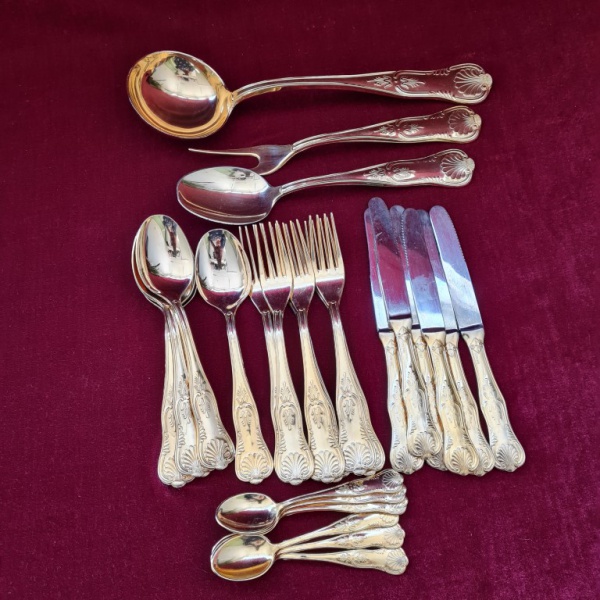
Find the location of a particular element. blades of butter knife is located at coordinates (363, 219), (377, 205), (393, 210), (407, 223), (424, 220), (436, 217).